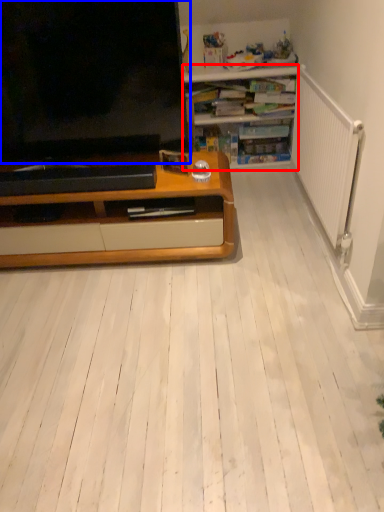
Question: Which object is further to the camera taking this photo, desk (highlighted by a red box) or television (highlighted by a blue box)?

Choices:
 (A) desk
 (B) television

Answer: (A)